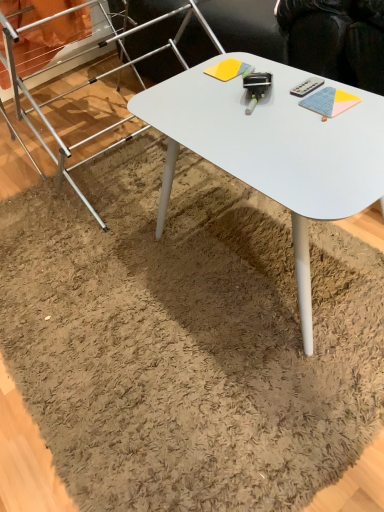
Where is `free spot to the left of black plastic remote control at upper right`? free spot to the left of black plastic remote control at upper right is located at coordinates (239, 105).